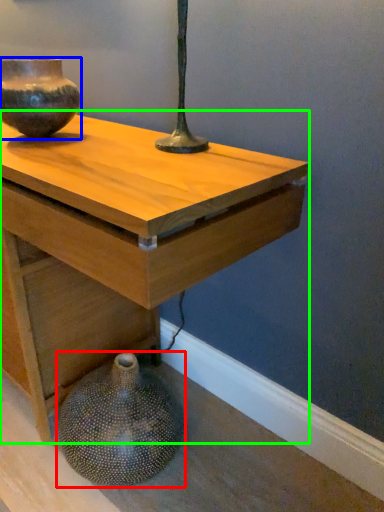
Question: Considering the real-world distances, which object is farthest from vase (highlighted by a red box)? vase (highlighted by a blue box) or table (highlighted by a green box)?

Choices:
 (A) vase
 (B) table

Answer: (A)